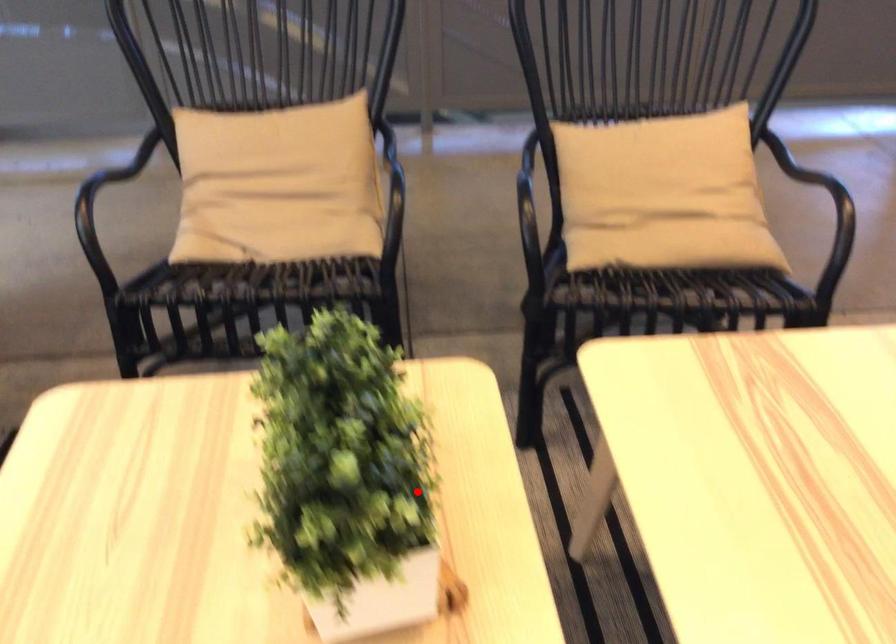
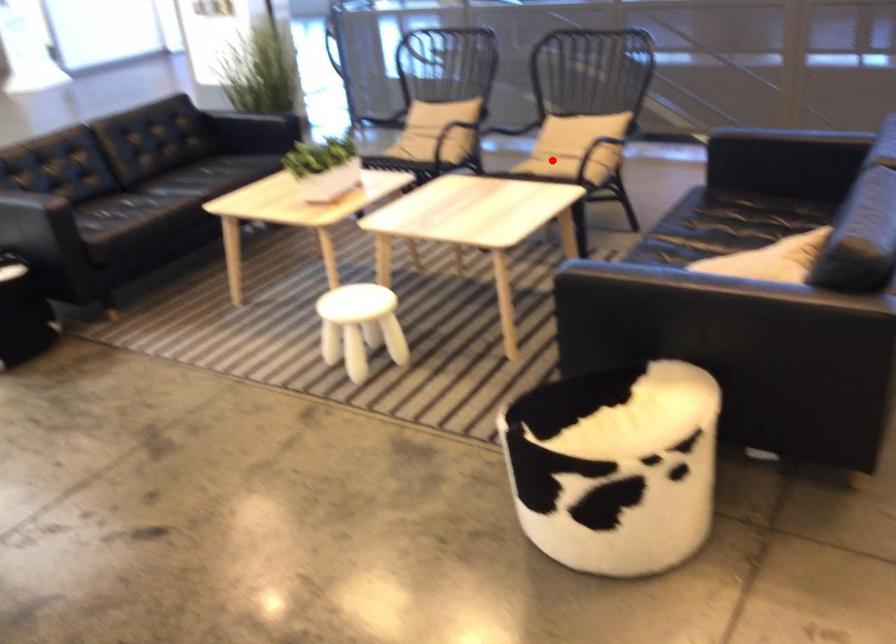
I am providing you with two images of the same scene from different viewpoints. A red point is marked on the first image and another point is marked on the second image. Are the points marked in image1 and image2 representing the same 3D position?

No